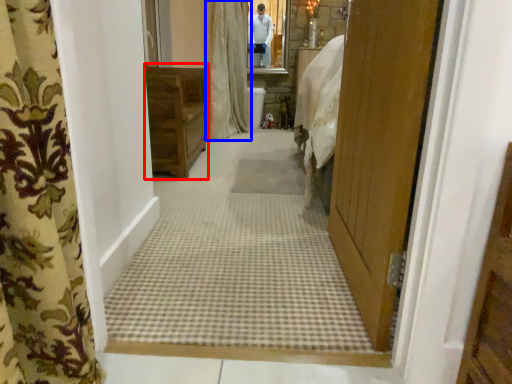
Question: Which of the following is the farthest to the observer, furniture (highlighted by a red box) or curtain (highlighted by a blue box)?

Choices:
 (A) furniture
 (B) curtain

Answer: (B)